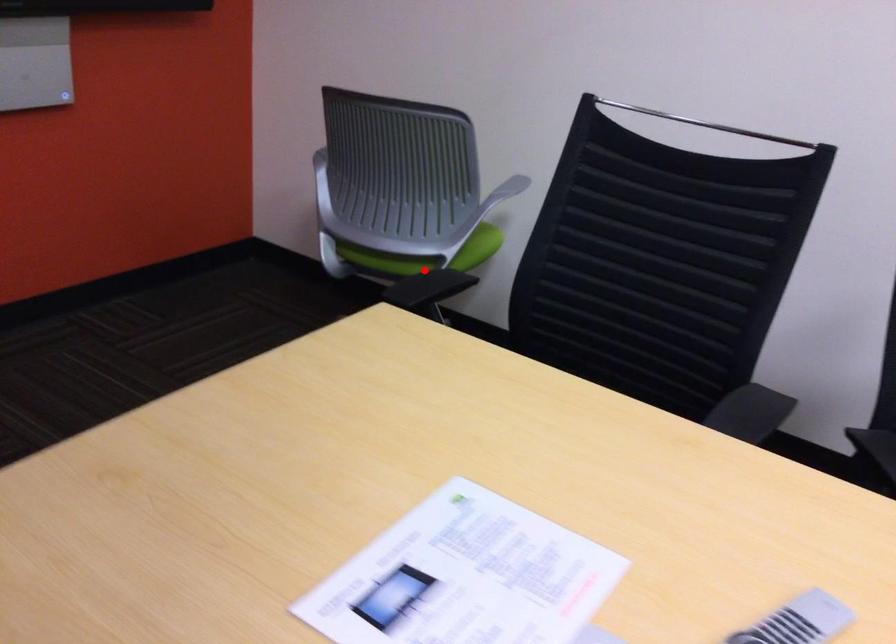
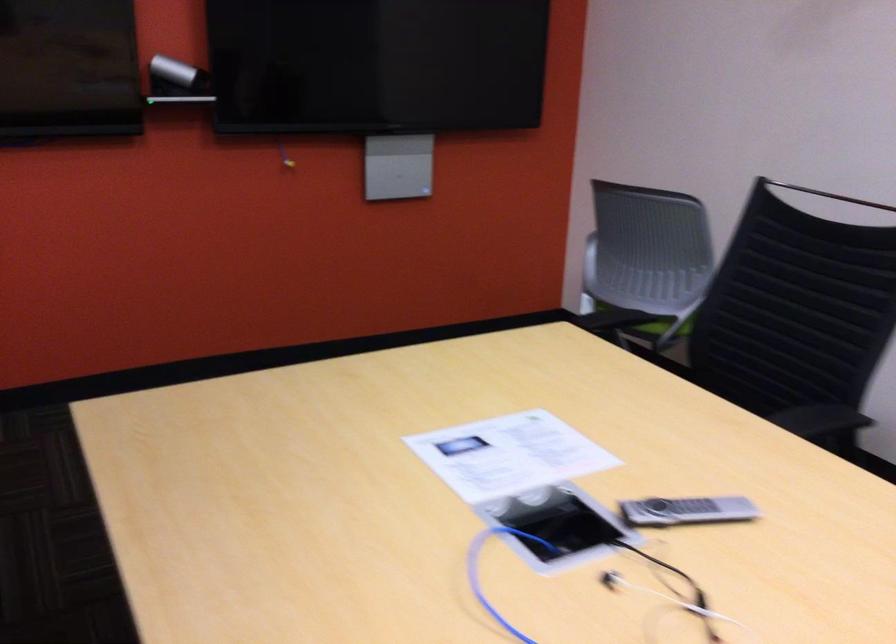
Question: A red point is marked in image1. In image2, is the corresponding 3D point closer to the camera or farther? Reply with the corresponding letter.

Choices:
 (A) The corresponding 3D point is closer.
 (B) The corresponding 3D point is farther.

Answer: (B)